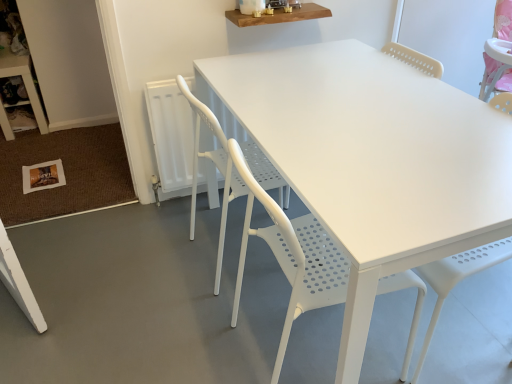
Question: Considering the positions of wooden shelf at upper center, arranged as the second table when viewed from the back, and white perforated plastic chair at center, which is the 2th chair from back to front, in the image, is wooden shelf at upper center, arranged as the second table when viewed from the back, taller or shorter than white perforated plastic chair at center, which is the 2th chair from back to front,?

Choices:
 (A) short
 (B) tall

Answer: (A)

Question: Considering the positions of wooden shelf at upper center, arranged as the second table when viewed from the back, and white perforated plastic chair at center, which is the 2th chair from back to front, in the image, is wooden shelf at upper center, arranged as the second table when viewed from the back, bigger or smaller than white perforated plastic chair at center, which is the 2th chair from back to front,?

Choices:
 (A) small
 (B) big

Answer: (A)

Question: Which object is the farthest from the white plastic table at lower left, positioned as the second table in front-to-back order?

Choices:
 (A) white perforated plastic chair at center, which is the 2th chair from back to front
 (B) wooden shelf at upper center, which appears as the first table when viewed from the right
 (C) white perforated plastic chair at center, marked as the second chair in a front-to-back arrangement

Answer: (A)

Question: Which of these objects is positioned closest to the wooden shelf at upper center, which is counted as the second table, starting from the left?

Choices:
 (A) white plastic table at lower left, positioned as the second table in front-to-back order
 (B) white perforated plastic chair at center, the first chair viewed from the back
 (C) white perforated plastic chair at center, which is the 2th chair from back to front

Answer: (B)